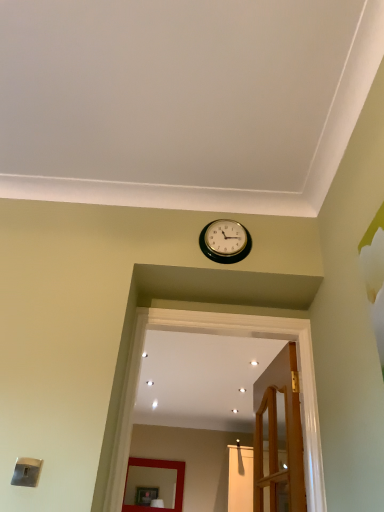
Question: Is gold metallic wall clock at upper center thinner than wooden door at center?

Choices:
 (A) yes
 (B) no

Answer: (A)

Question: Considering the relative sizes of gold metallic wall clock at upper center and wooden door at center in the image provided, is gold metallic wall clock at upper center shorter than wooden door at center?

Choices:
 (A) yes
 (B) no

Answer: (A)

Question: Is gold metallic wall clock at upper center positioned with its back to wooden door at center?

Choices:
 (A) no
 (B) yes

Answer: (A)

Question: Considering the relative sizes of gold metallic wall clock at upper center and wooden door at center in the image provided, is gold metallic wall clock at upper center smaller than wooden door at center?

Choices:
 (A) no
 (B) yes

Answer: (B)

Question: Is the depth of gold metallic wall clock at upper center greater than that of wooden door at center?

Choices:
 (A) no
 (B) yes

Answer: (B)

Question: In the image, is matte red mirror at center on the left side or the right side of gold metallic wall clock at upper center?

Choices:
 (A) right
 (B) left

Answer: (B)

Question: From the image's perspective, is matte red mirror at center positioned above or below gold metallic wall clock at upper center?

Choices:
 (A) below
 (B) above

Answer: (A)

Question: Is matte red mirror at center wider or thinner than gold metallic wall clock at upper center?

Choices:
 (A) wide
 (B) thin

Answer: (A)

Question: Looking at the image, does matte red mirror at center seem bigger or smaller compared to gold metallic wall clock at upper center?

Choices:
 (A) big
 (B) small

Answer: (A)

Question: Do you think matte red mirror at center is within wooden door at center, or outside of it?

Choices:
 (A) outside
 (B) inside

Answer: (A)

Question: In terms of size, does matte red mirror at center appear bigger or smaller than wooden door at center?

Choices:
 (A) big
 (B) small

Answer: (A)

Question: Looking at their shapes, would you say matte red mirror at center is wider or thinner than wooden door at center?

Choices:
 (A) wide
 (B) thin

Answer: (A)

Question: In the image, is matte red mirror at center positioned in front of or behind wooden door at center?

Choices:
 (A) behind
 (B) front

Answer: (A)

Question: Is point (228, 250) positioned closer to the camera than point (148, 508)?

Choices:
 (A) farther
 (B) closer

Answer: (B)

Question: In the image, is gold metallic wall clock at upper center positioned in front of or behind matte red mirror at center?

Choices:
 (A) front
 (B) behind

Answer: (A)